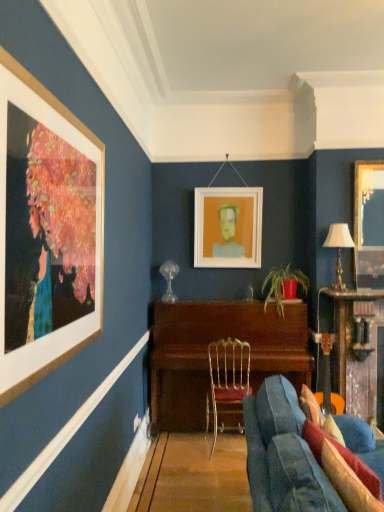
Question: Is white matte picture frame at center, which appears as the 1th picture frame when viewed from the left, taller or shorter than matte red pot at center?

Choices:
 (A) tall
 (B) short

Answer: (A)

Question: Is white matte picture frame at center, placed as the second picture frame when sorted from right to left, spatially inside matte red pot at center, or outside of it?

Choices:
 (A) inside
 (B) outside

Answer: (B)

Question: Which object is positioned closest to the wooden piano at center, positioned as the 2th table in right-to-left order?

Choices:
 (A) gold-framed mirror at upper right, which is counted as the second picture frame, starting from the back
 (B) white matte picture frame at center, which appears as the 1th picture frame when viewed from the left
 (C) matte red pot at center
 (D) velvet blue couch at lower right
 (E) wooden table at right, positioned as the second table in left-to-right order

Answer: (C)

Question: Considering the real-world distances, which object is closest to the gold metallic chair at center?

Choices:
 (A) wooden piano at center, positioned as the 2th table in right-to-left order
 (B) white matte picture frame at center, placed as the second picture frame when sorted from right to left
 (C) velvet blue couch at lower right
 (D) gold metallic table lamp at right
 (E) matte red pot at center

Answer: (A)